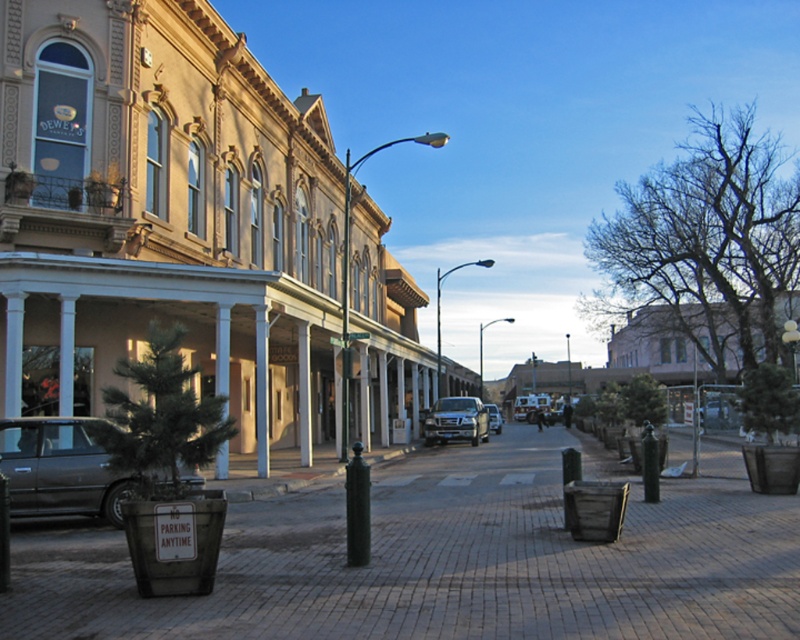
Is point (516, 406) farther from viewer compared to point (494, 410)?

Yes, it is.

Where is `metallic silver suv at center`? metallic silver suv at center is located at coordinates (525, 406).

Which is in front, point (529, 400) or point (494, 417)?

Point (494, 417)

At what (x,y) coordinates should I click in order to perform the action: click on metallic silver suv at center. Please return your answer as a coordinate pair (x, y). Looking at the image, I should click on (525, 406).

Is the position of matte black car at left more distant than that of brushed metal pillar at center?

Yes, matte black car at left is behind brushed metal pillar at center.

Measure the distance between matte black car at left and brushed metal pillar at center.

They are 4.84 meters apart.

Who is more distant from viewer, (x=38, y=474) or (x=226, y=476)?

The point (x=226, y=476) is behind.

The width and height of the screenshot is (800, 640). What are the coordinates of `matte black car at left` in the screenshot? It's located at (58, 468).

Is the position of brushed metal pillar at center less distant than that of metallic silver truck at center?

Yes, brushed metal pillar at center is closer to the viewer.

Based on the photo, between brushed metal pillar at center and metallic silver truck at center, which one appears on the left side from the viewer's perspective?

brushed metal pillar at center is more to the left.

Describe the element at coordinates (222, 348) in the screenshot. I see `brushed metal pillar at center` at that location.

This screenshot has height=640, width=800. Find the location of `brushed metal pillar at center`. brushed metal pillar at center is located at coordinates (222, 348).